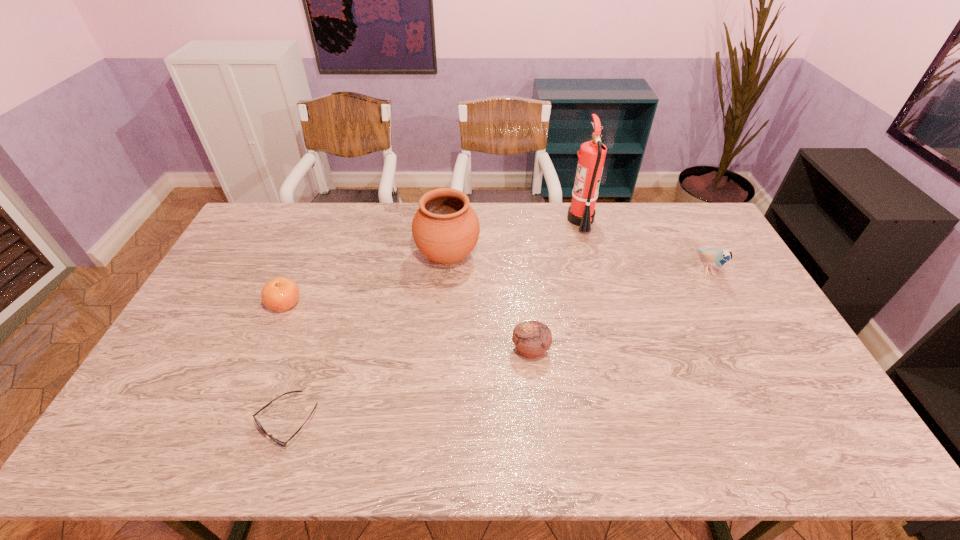
At what (x,y) coordinates should I click in order to perform the action: click on pottery present at the far edge. Please return your answer as a coordinate pair (x, y). The width and height of the screenshot is (960, 540). Looking at the image, I should click on (445, 228).

You are a GUI agent. You are given a task and a screenshot of the screen. Output one action in this format:
    pyautogui.click(x=<x>, y=<y>)
    Task: Click on the object at the near edge
    The image size is (960, 540).
    Given the screenshot: What is the action you would take?
    pyautogui.click(x=284, y=444)

Find the location of a particular element. object at the right edge is located at coordinates (717, 258).

The width and height of the screenshot is (960, 540). In the image, there is a desktop. In order to click on vacant space at the far edge in this screenshot , I will do `click(546, 218)`.

Image resolution: width=960 pixels, height=540 pixels. In the image, there is a desktop. Find the location of `vacant space at the near edge`. vacant space at the near edge is located at coordinates (201, 435).

At what (x,y) coordinates should I click in order to perform the action: click on vacant space at the left edge of the desktop. Please return your answer as a coordinate pair (x, y). Looking at the image, I should click on (225, 273).

Find the location of a particular element. vacant space at the right edge is located at coordinates (774, 402).

The width and height of the screenshot is (960, 540). I want to click on vacant space at the far left corner of the desktop, so click(267, 215).

Locate an element on the screen. vacant region at the far right corner is located at coordinates pos(686,219).

Identify the location of vacant region between the second nearest object and the tallest object. Image resolution: width=960 pixels, height=540 pixels. click(556, 285).